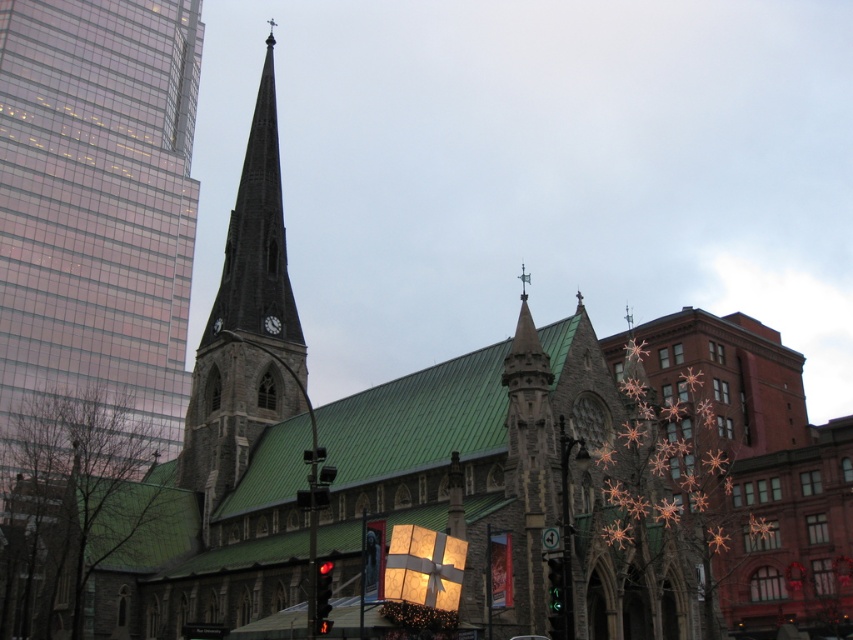
Question: Which point is closer to the camera taking this photo?

Choices:
 (A) (553, 593)
 (B) (331, 564)
 (C) (256, 326)

Answer: (B)

Question: Based on their relative distances, which object is nearer to the green glass traffic light at center?

Choices:
 (A) red glass traffic light at lower center
 (B) glassy pink skyscraper at left
 (C) dark gray stone tower at center-left

Answer: (A)

Question: Can you confirm if red glass traffic light at lower center is positioned below green glass traffic light at center?

Choices:
 (A) yes
 (B) no

Answer: (A)

Question: In this image, where is red glass traffic light at lower center located relative to green glass traffic light at center?

Choices:
 (A) above
 (B) below

Answer: (B)

Question: Considering the relative positions of dark gray stone tower at center-left and green glass traffic light at center in the image provided, where is dark gray stone tower at center-left located with respect to green glass traffic light at center?

Choices:
 (A) above
 (B) below

Answer: (A)

Question: Which of these objects is positioned farthest from the dark gray stone tower at center-left?

Choices:
 (A) glassy pink skyscraper at left
 (B) red glass traffic light at lower center

Answer: (A)